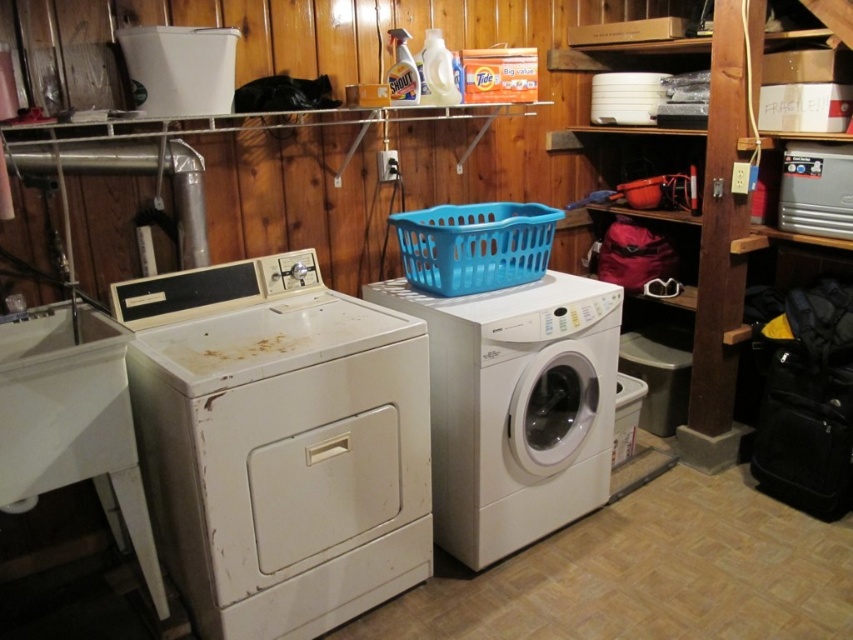
Question: Which object appears closest to the camera in this image?

Choices:
 (A) white glossy washing machine at center
 (B) blue plastic basket at center
 (C) silver metallic refrigerator at upper right
 (D) white matte washing machine at left

Answer: (D)

Question: Which point is farther from the camera taking this photo?

Choices:
 (A) (492, 284)
 (B) (799, 189)
 (C) (288, 275)

Answer: (B)

Question: Does blue plastic basket at center appear over silver metallic refrigerator at upper right?

Choices:
 (A) no
 (B) yes

Answer: (A)

Question: Is white matte washing machine at left thinner than blue plastic basket at center?

Choices:
 (A) yes
 (B) no

Answer: (B)

Question: Which object is positioned closest to the silver metallic refrigerator at upper right?

Choices:
 (A) white glossy washing machine at center
 (B) white matte washing machine at left

Answer: (A)

Question: Can you confirm if white matte washing machine at left is smaller than blue plastic basket at center?

Choices:
 (A) no
 (B) yes

Answer: (A)